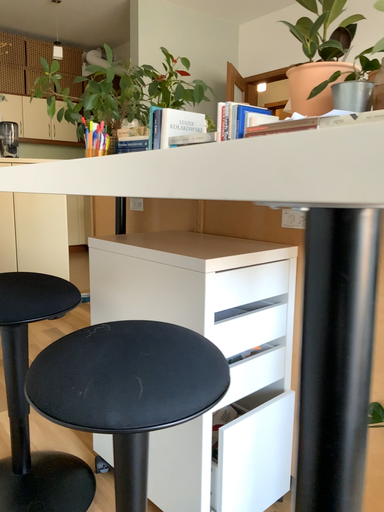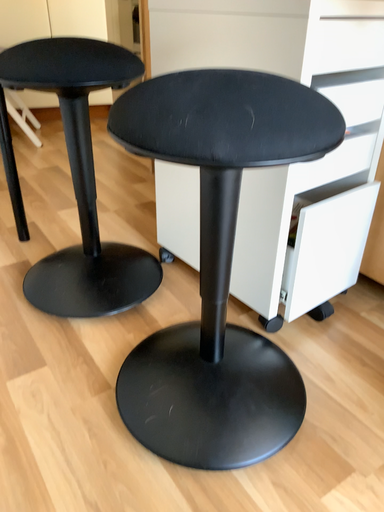
Question: How did the camera likely rotate when shooting the video?

Choices:
 (A) rotated downward
 (B) rotated upward

Answer: (A)